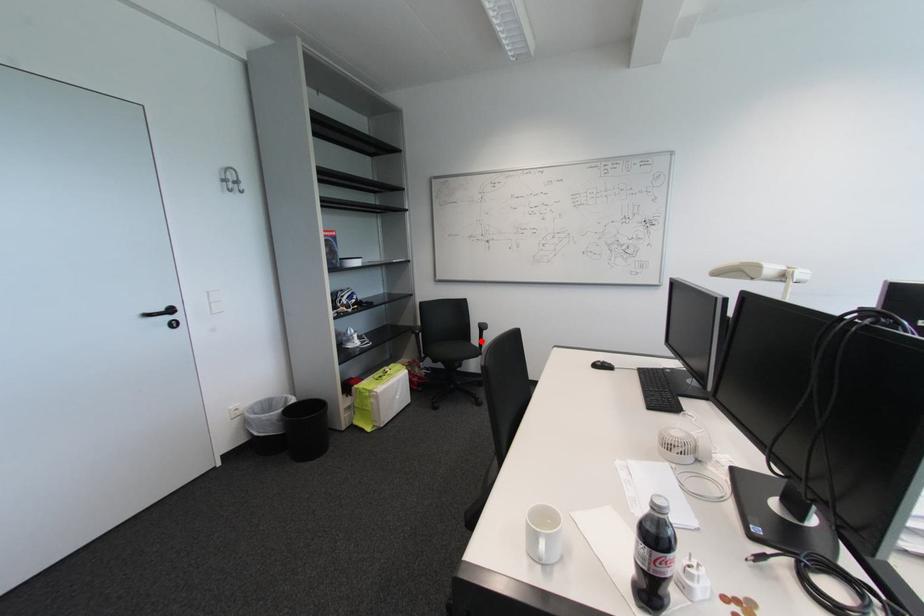
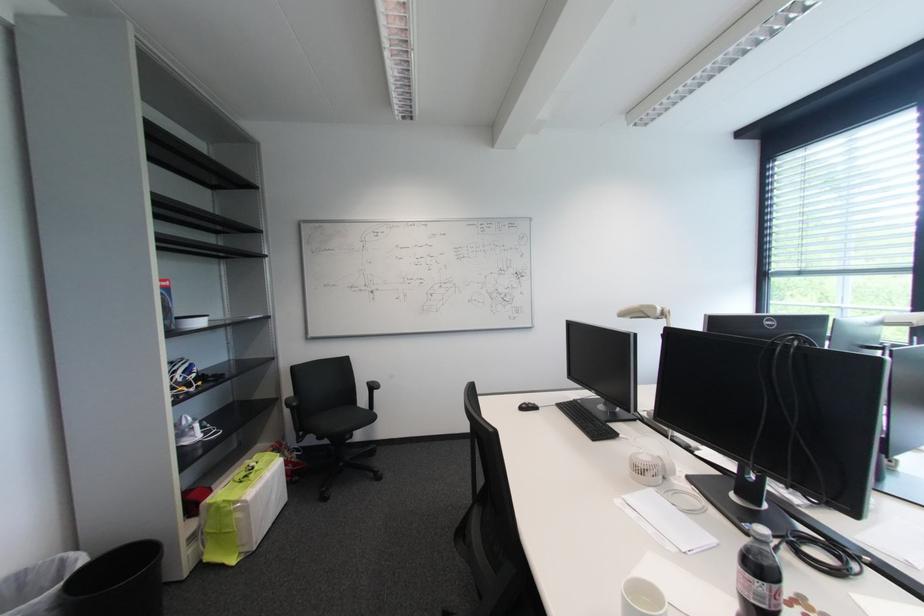
Question: I am providing you with two images of the same scene from different viewpoints. Image1 has a red point marked. In image2, the corresponding 3D location appears at what relative position? Reply with the corresponding letter.

Choices:
 (A) Closer
 (B) Farther

Answer: (B)